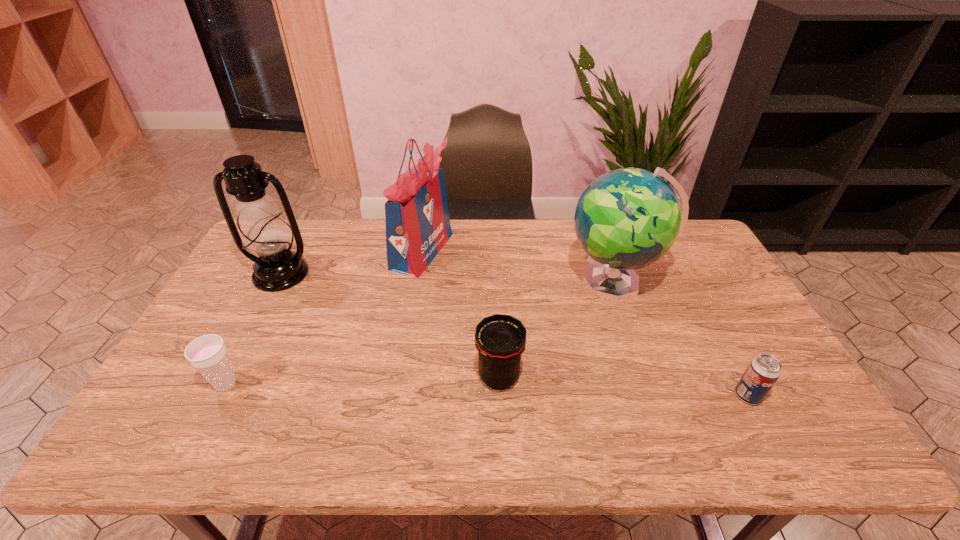
In order to click on free space that satisfies the following two spatial constraints: 1. on the front-facing side of the beer can; 2. on the left side of the third object from left to right in this screenshot , I will do `click(398, 395)`.

Where is `vacant point that satisfies the following two spatial constraints: 1. on the front-facing side of the grocery bag; 2. on the left side of the beer can`? Image resolution: width=960 pixels, height=540 pixels. vacant point that satisfies the following two spatial constraints: 1. on the front-facing side of the grocery bag; 2. on the left side of the beer can is located at coordinates (398, 395).

At what (x,y) coordinates should I click in order to perform the action: click on vacant space that satisfies the following two spatial constraints: 1. on the front side of the cup; 2. on the left side of the oil lamp. Please return your answer as a coordinate pair (x, y). The image size is (960, 540). Looking at the image, I should click on (223, 384).

You are a GUI agent. You are given a task and a screenshot of the screen. Output one action in this format:
    pyautogui.click(x=<x>, y=<y>)
    Task: Click on the free space that satisfies the following two spatial constraints: 1. on the front surface of the globe; 2. on the left side of the beer can
    Image resolution: width=960 pixels, height=540 pixels.
    Given the screenshot: What is the action you would take?
    pyautogui.click(x=654, y=395)